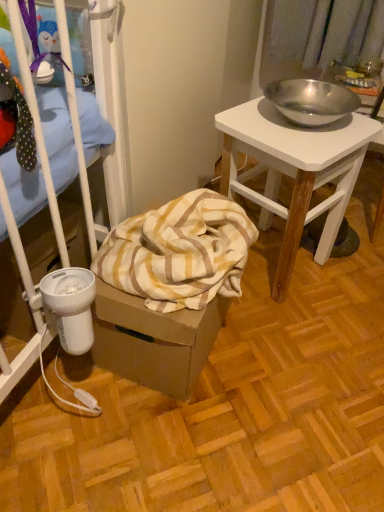
You are a GUI agent. You are given a task and a screenshot of the screen. Output one action in this format:
    pyautogui.click(x=<x>, y=<y>)
    Task: Click on the vacant space underneath polished metal bowl at upper right (from a real-world perspective)
    Image resolution: width=384 pixels, height=512 pixels.
    Given the screenshot: What is the action you would take?
    pyautogui.click(x=291, y=270)